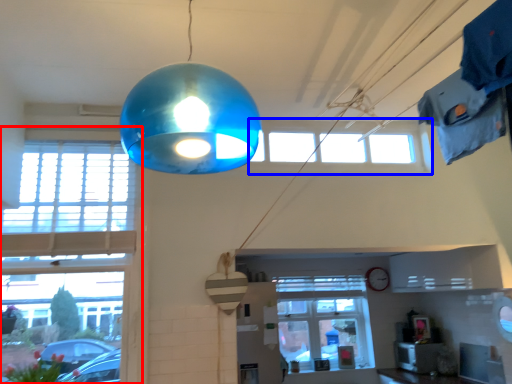
Question: Among these objects, which one is nearest to the camera, window (highlighted by a red box) or window (highlighted by a blue box)?

Choices:
 (A) window
 (B) window

Answer: (A)